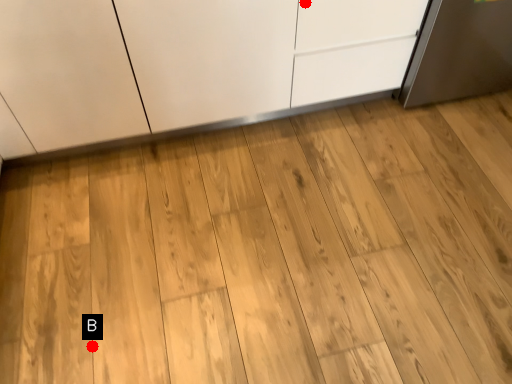
Question: Two points are circled on the image, labeled by A and B beside each circle. Which of the following is the closest to the observer?

Choices:
 (A) A is closer
 (B) B is closer

Answer: (B)